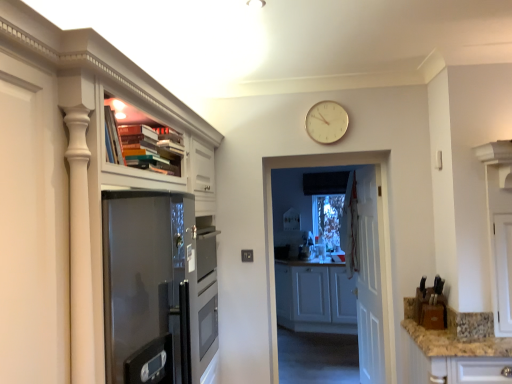
Question: From the image's perspective, does granite countertop at lower right appear higher than white matte cabinet at center, the 2th cabinetry from the left?

Choices:
 (A) yes
 (B) no

Answer: (A)

Question: Is granite countertop at lower right taller than white matte cabinet at center, the 2th cabinetry from the left?

Choices:
 (A) no
 (B) yes

Answer: (A)

Question: Is granite countertop at lower right in contact with white matte cabinet at center, the first cabinetry viewed from the right?

Choices:
 (A) yes
 (B) no

Answer: (B)

Question: Is granite countertop at lower right smaller than white matte cabinet at center, the 2th cabinetry from the left?

Choices:
 (A) yes
 (B) no

Answer: (A)

Question: Is white matte cabinet at center, the first cabinetry positioned from the back, at the back of granite countertop at lower right?

Choices:
 (A) no
 (B) yes

Answer: (B)

Question: Is granite countertop at lower right to the left of white matte cabinet at center, the first cabinetry positioned from the back, from the viewer's perspective?

Choices:
 (A) no
 (B) yes

Answer: (A)

Question: Are granite countertop at lower right and white wooden door at center making contact?

Choices:
 (A) no
 (B) yes

Answer: (A)

Question: Can you confirm if granite countertop at lower right is bigger than white wooden door at center?

Choices:
 (A) yes
 (B) no

Answer: (A)

Question: Considering the relative positions of granite countertop at lower right and white wooden door at center in the image provided, is granite countertop at lower right to the right of white wooden door at center from the viewer's perspective?

Choices:
 (A) no
 (B) yes

Answer: (B)

Question: Does granite countertop at lower right have a smaller size compared to white wooden door at center?

Choices:
 (A) yes
 (B) no

Answer: (B)

Question: From the image's perspective, is granite countertop at lower right over white wooden door at center?

Choices:
 (A) no
 (B) yes

Answer: (A)

Question: From a real-world perspective, is granite countertop at lower right physically below white wooden door at center?

Choices:
 (A) no
 (B) yes

Answer: (B)

Question: From a real-world perspective, is matte white cabinet at upper left, acting as the 2th cabinetry starting from the right, over white glossy door at center?

Choices:
 (A) yes
 (B) no

Answer: (A)